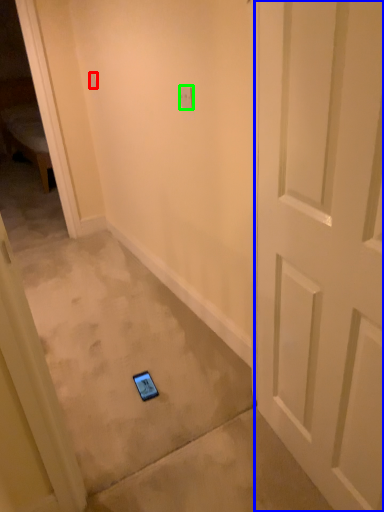
Question: Which object is the closest to the light switch (highlighted by a red box)? Choose among these: door (highlighted by a blue box) or light switch (highlighted by a green box).

Choices:
 (A) door
 (B) light switch

Answer: (B)